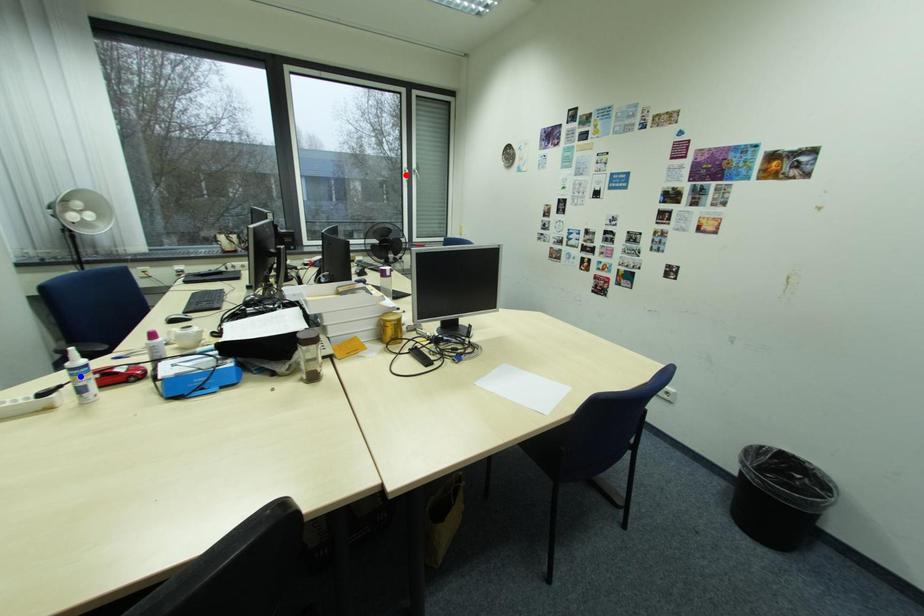
Question: Two points are marked on the image. Which point is closer to the camera?

Choices:
 (A) Blue point is closer.
 (B) Red point is closer.

Answer: (A)